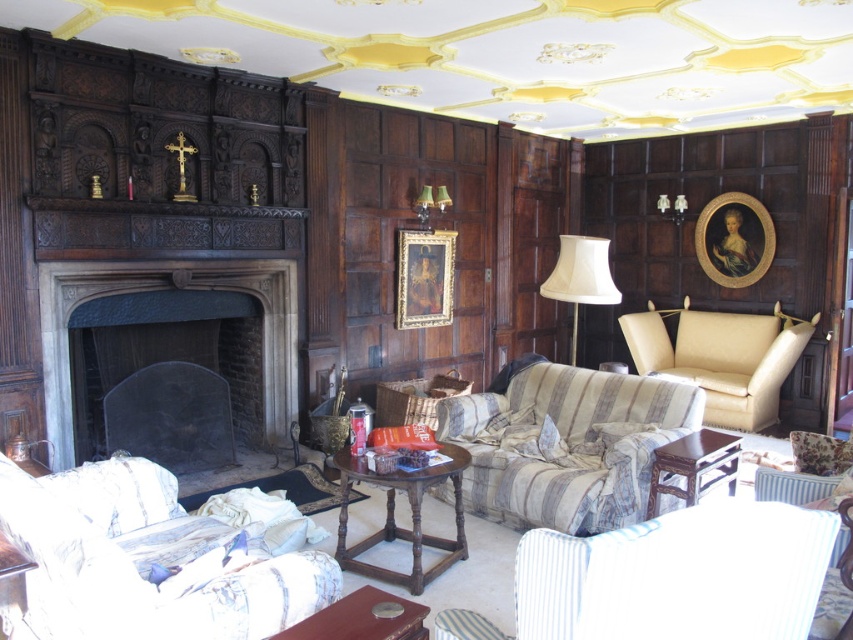
You are a delivery person who needs to place a package on the wooden coffee table at center. You are currently standing next to the goldwooden frame at upper right. Is the distance between them sufficient for you to carry the package without needing to navigate around any obstacles?

The distance between the goldwooden frame at upper right and the wooden coffee table at center is 5.56 meters. Since there are no obstacles mentioned in the scene description, you can carry the package directly to the table.